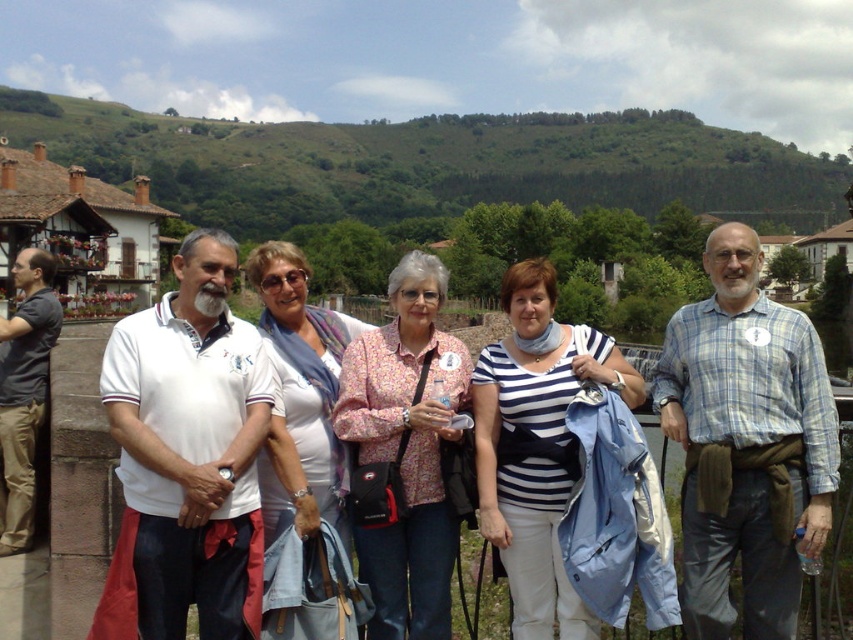
Is point (525, 326) less distant than point (289, 289)?

That is True.

Who is positioned more to the left, white striped shirt at center or white fabric scarf at center?

white fabric scarf at center is more to the left.

Does point (590, 636) come behind point (318, 380)?

No, (590, 636) is in front of (318, 380).

Where is `white striped shirt at center`? This screenshot has width=853, height=640. white striped shirt at center is located at coordinates (537, 445).

Which is more to the left, white cotton polo shirt at center or blue plaid shirt at center?

white cotton polo shirt at center is more to the left.

Does white cotton polo shirt at center have a larger size compared to blue plaid shirt at center?

Yes.

Which is behind, point (247, 563) or point (712, 608)?

The point (712, 608) is more distant.

Find the location of a particular element. The width and height of the screenshot is (853, 640). white cotton polo shirt at center is located at coordinates (186, 456).

Does point (675, 372) come closer to viewer compared to point (654, 420)?

No, (675, 372) is behind (654, 420).

Which is behind, point (701, 413) or point (53, 468)?

The point (701, 413) is more distant.

The height and width of the screenshot is (640, 853). I want to click on blue plaid shirt at center, so click(x=746, y=444).